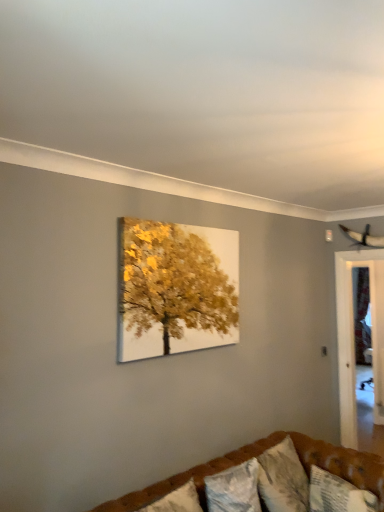
Question: Is transparent glass door at right to the left of textured white pillow at lower center, positioned as the 1th pillow in left-to-right order, from the viewer's perspective?

Choices:
 (A) no
 (B) yes

Answer: (A)

Question: Is the position of transparent glass door at right more distant than that of textured white pillow at lower center, arranged as the 2th pillow when viewed from the right?

Choices:
 (A) yes
 (B) no

Answer: (A)

Question: Is transparent glass door at right shorter than textured white pillow at lower center, positioned as the 1th pillow in left-to-right order?

Choices:
 (A) no
 (B) yes

Answer: (A)

Question: Is transparent glass door at right directly adjacent to textured white pillow at lower center, arranged as the 2th pillow when viewed from the right?

Choices:
 (A) no
 (B) yes

Answer: (A)

Question: Could you tell me if transparent glass door at right is turned towards textured white pillow at lower center, arranged as the 2th pillow when viewed from the right?

Choices:
 (A) no
 (B) yes

Answer: (B)

Question: In terms of size, does transparent glass door at right appear bigger or smaller than textured white pillow at lower center, positioned as the 1th pillow in left-to-right order?

Choices:
 (A) big
 (B) small

Answer: (A)

Question: In the image, is transparent glass door at right on the left side or the right side of textured white pillow at lower center, positioned as the 1th pillow in left-to-right order?

Choices:
 (A) left
 (B) right

Answer: (B)

Question: Is transparent glass door at right taller or shorter than textured white pillow at lower center, positioned as the 1th pillow in left-to-right order?

Choices:
 (A) tall
 (B) short

Answer: (A)

Question: Is point (350, 325) closer or farther from the camera than point (226, 493)?

Choices:
 (A) farther
 (B) closer

Answer: (A)

Question: From a real-world perspective, is textured white pillow at lower right, which appears as the first pillow when viewed from the right, positioned above or below transparent glass door at right?

Choices:
 (A) below
 (B) above

Answer: (A)

Question: Does point (339, 490) appear closer or farther from the camera than point (347, 423)?

Choices:
 (A) closer
 (B) farther

Answer: (A)

Question: In terms of size, does textured white pillow at lower right, the 2th pillow viewed from the left, appear bigger or smaller than transparent glass door at right?

Choices:
 (A) small
 (B) big

Answer: (A)

Question: From the image's perspective, is textured white pillow at lower right, which appears as the first pillow when viewed from the right, above or below transparent glass door at right?

Choices:
 (A) below
 (B) above

Answer: (A)

Question: From the image's perspective, is brown tufted couch at lower center located above or below textured white pillow at lower right, which appears as the first pillow when viewed from the right?

Choices:
 (A) above
 (B) below

Answer: (B)

Question: Is brown tufted couch at lower center wider or thinner than textured white pillow at lower right, which appears as the first pillow when viewed from the right?

Choices:
 (A) wide
 (B) thin

Answer: (A)